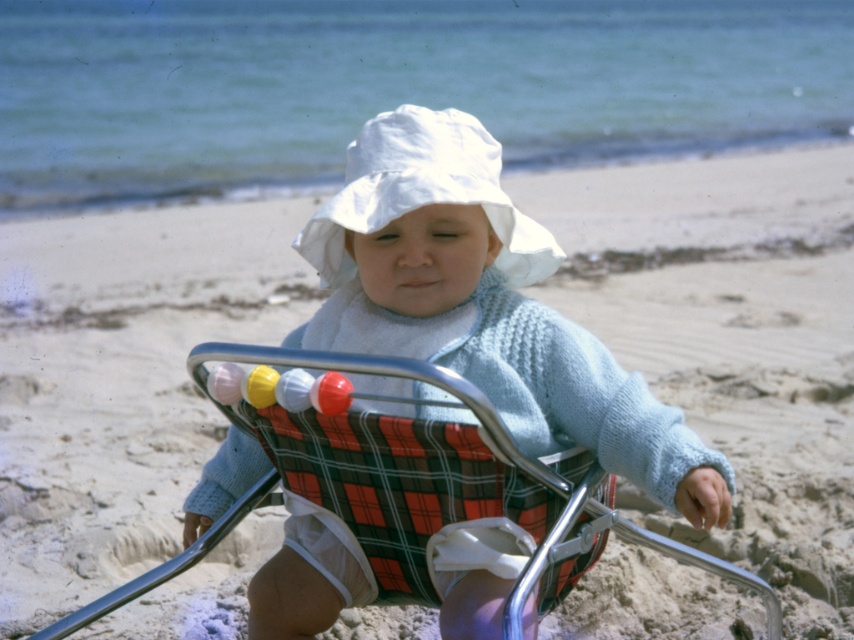
You are standing at the point marked as point (x=299, y=557) on the beach. You want to pick up a seashell that is exactly 3 meters away from you. Can you reach it without moving?

The distance between you and the viewer is 2.46 meters, so if the seashell is 3 meters away from you, it is beyond your reach without moving.

You are a parent trying to decide which item to pack first for your baby. You have the white knitted sweater at center and the plaid fabric baby carriage at center. Which item is easier to fold and store in a small bag?

The white knitted sweater at center is thinner than the plaid fabric baby carriage at center, so it is easier to fold and store in a small bag.